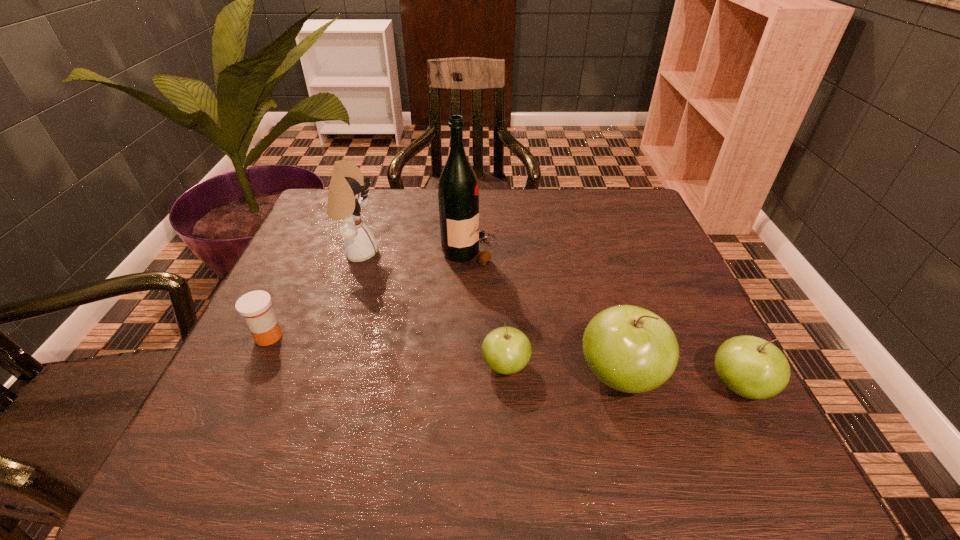
Please point a spot on the left to add another apple. Please provide its 2D coordinates. Your answer should be formatted as a tuple, i.e. [(x, y)], where the tuple contains the x and y coordinates of a point satisfying the conditions above.

[(396, 356)]